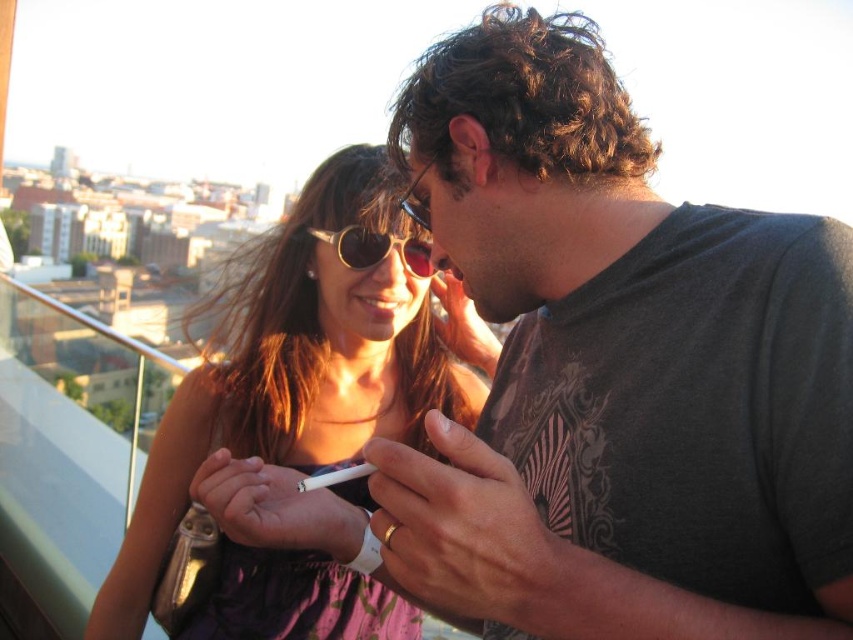
You are a drone operator trying to capture a photo of the two people on the balcony. You need to adjust your drone to focus on the closer point between point (314, 305) and point (355, 244). Which point should you focus on?

Point (314, 305) is further to the viewer than point (355, 244), so you should focus on point (355, 244) since it is closer to the viewer.